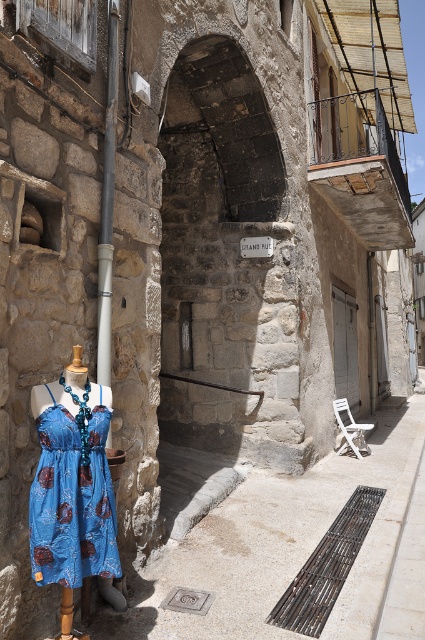
Question: Which of the following is the farthest from the observer?

Choices:
 (A) (x=329, y=602)
 (B) (x=112, y=572)

Answer: (A)

Question: Does blue printed fabric dress at left have a smaller size compared to smooth gray pipe at center-left?

Choices:
 (A) yes
 (B) no

Answer: (B)

Question: Observing the image, what is the correct spatial positioning of blue printed fabric dress at left in reference to rusty metal grate at lower center?

Choices:
 (A) above
 (B) below

Answer: (A)

Question: Which of the following is the closest to the observer?

Choices:
 (A) (291, 592)
 (B) (108, 44)

Answer: (B)

Question: Does blue printed fabric dress at left appear on the left side of rusty metal grate at lower center?

Choices:
 (A) yes
 (B) no

Answer: (A)

Question: Which point is closer to the camera taking this photo?

Choices:
 (A) (113, 573)
 (B) (110, 243)
 (C) (295, 609)

Answer: (A)